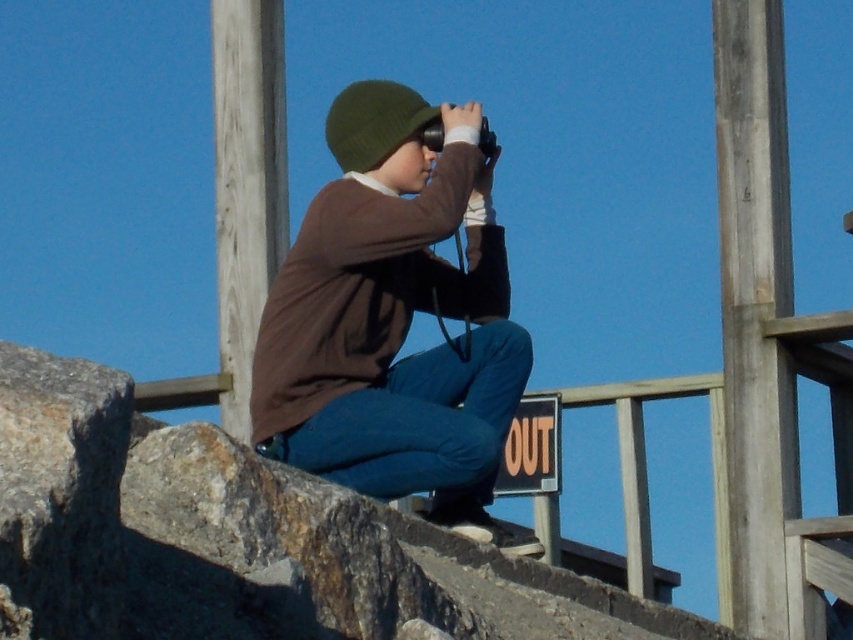
Question: Does smooth gray pole at upper right appear over green woolen hat at center?

Choices:
 (A) yes
 (B) no

Answer: (B)

Question: Is the position of smooth gray pole at upper right more distant than that of green woolen hat at center?

Choices:
 (A) yes
 (B) no

Answer: (A)

Question: Considering the real-world distances, which object is farthest from the smooth wood pole at upper left?

Choices:
 (A) brown cotton shirt at center
 (B) green woolen hat at center

Answer: (A)

Question: Estimate the real-world distances between objects in this image. Which object is closer to the green woolen hat at center?

Choices:
 (A) smooth gray pole at upper right
 (B) brown cotton shirt at center
 (C) smooth wood pole at upper left

Answer: (B)

Question: Estimate the real-world distances between objects in this image. Which object is farther from the smooth gray pole at upper right?

Choices:
 (A) brown cotton shirt at center
 (B) smooth wood pole at upper left

Answer: (B)

Question: Considering the relative positions of smooth gray pole at upper right and smooth wood pole at upper left in the image provided, where is smooth gray pole at upper right located with respect to smooth wood pole at upper left?

Choices:
 (A) below
 (B) above

Answer: (A)